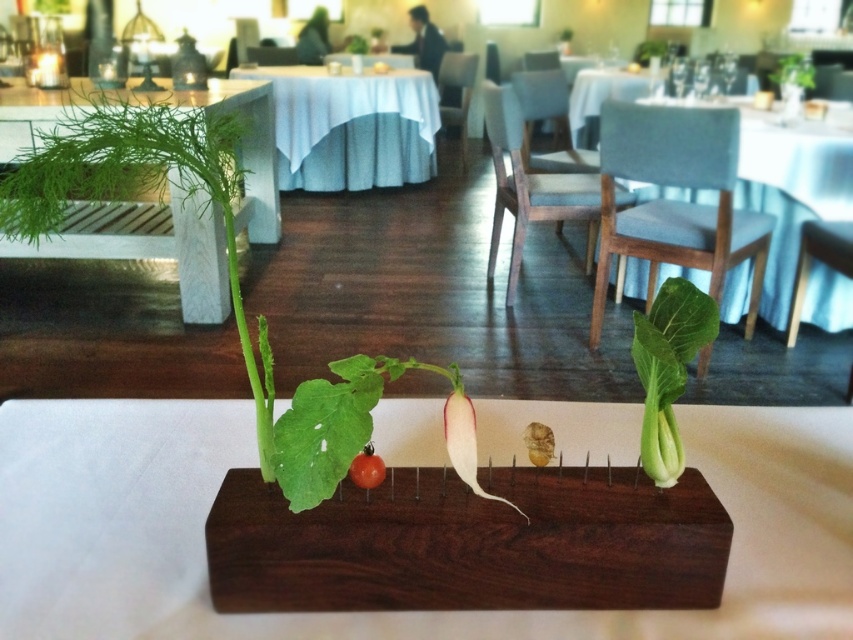
Question: Considering the real-world distances, which object is farthest from the green leafy plant at upper left?

Choices:
 (A) dark wood rectangular block at center
 (B) green leafy bok choy at center
 (C) green leafy at center

Answer: (B)

Question: Which point is farther to the camera?

Choices:
 (A) white fabric table at center
 (B) wooden chair at center
 (C) green leafy at center
 (D) green leafy plant at upper left

Answer: (A)

Question: Does green leafy at center have a greater width compared to white fabric table at center?

Choices:
 (A) yes
 (B) no

Answer: (B)

Question: Does wooden chair at center have a greater width compared to white cloth table at center?

Choices:
 (A) no
 (B) yes

Answer: (A)

Question: Which of the following is the farthest from the observer?

Choices:
 (A) green leafy bok choy at center
 (B) dark wood rectangular block at center
 (C) wooden chair at center

Answer: (C)

Question: Can you confirm if green leafy plant at upper left is bigger than white fabric table at center?

Choices:
 (A) yes
 (B) no

Answer: (B)